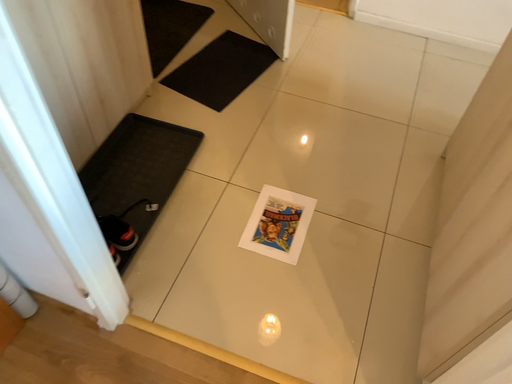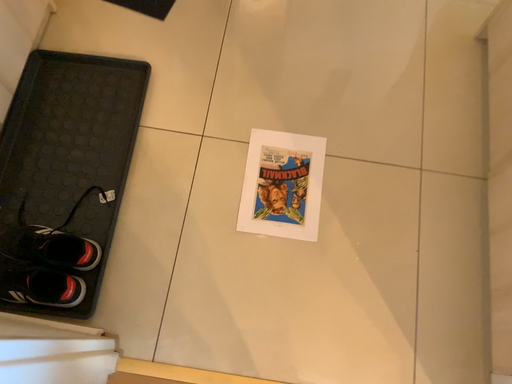
Question: Which way did the camera rotate in the video?

Choices:
 (A) rotated downward
 (B) rotated upward

Answer: (A)